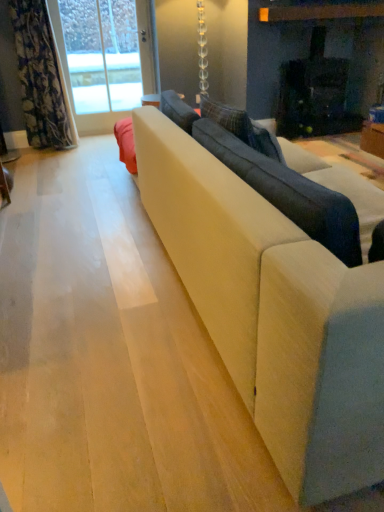
Question: Is suede-like beige couch at center closer to camera compared to floral fabric curtain at left?

Choices:
 (A) yes
 (B) no

Answer: (A)

Question: Does suede-like beige couch at center have a greater height compared to floral fabric curtain at left?

Choices:
 (A) no
 (B) yes

Answer: (A)

Question: Does suede-like beige couch at center have a lesser width compared to floral fabric curtain at left?

Choices:
 (A) yes
 (B) no

Answer: (B)

Question: From the image's perspective, would you say suede-like beige couch at center is shown under floral fabric curtain at left?

Choices:
 (A) no
 (B) yes

Answer: (B)

Question: From a real-world perspective, is suede-like beige couch at center over floral fabric curtain at left?

Choices:
 (A) no
 (B) yes

Answer: (A)

Question: Considering the relative positions of suede-like beige couch at center and floral fabric curtain at left in the image provided, is suede-like beige couch at center to the left of floral fabric curtain at left from the viewer's perspective?

Choices:
 (A) no
 (B) yes

Answer: (A)

Question: From the image's perspective, is suede-like beige couch at center located above suede-like beige couch at center?

Choices:
 (A) no
 (B) yes

Answer: (A)

Question: Does suede-like beige couch at center have a lesser height compared to suede-like beige couch at center?

Choices:
 (A) yes
 (B) no

Answer: (A)

Question: Does suede-like beige couch at center appear on the right side of suede-like beige couch at center?

Choices:
 (A) yes
 (B) no

Answer: (B)

Question: Is suede-like beige couch at center outside suede-like beige couch at center?

Choices:
 (A) no
 (B) yes

Answer: (A)

Question: Would you say suede-like beige couch at center contains suede-like beige couch at center?

Choices:
 (A) yes
 (B) no

Answer: (B)

Question: Does suede-like beige couch at center have a greater width compared to suede-like beige couch at center?

Choices:
 (A) no
 (B) yes

Answer: (A)

Question: Can you confirm if floral fabric curtain at left is shorter than clear glass door at upper left?

Choices:
 (A) yes
 (B) no

Answer: (A)